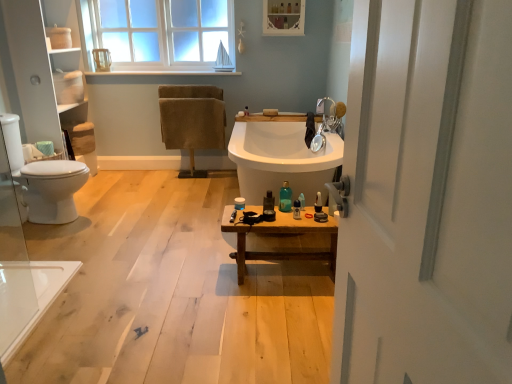
Find the location of a particular element. vacant area that is in front of matte black razor at center, marked as the sixth toiletry in a left-to-right arrangement is located at coordinates (315, 213).